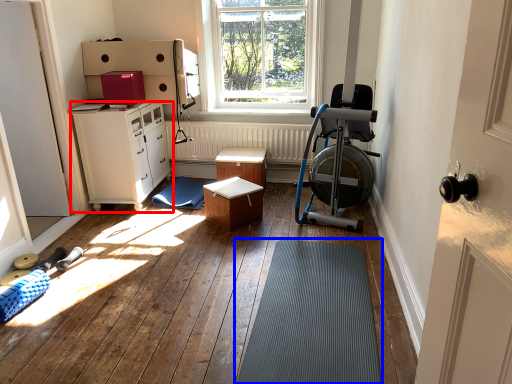
Question: Which object appears closest to the camera in this image, chest of drawers (highlighted by a red box) or bath mat (highlighted by a blue box)?

Choices:
 (A) chest of drawers
 (B) bath mat

Answer: (B)